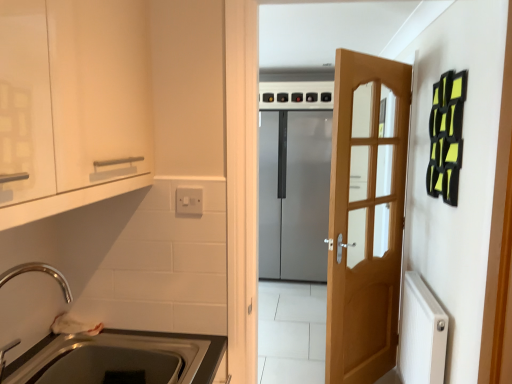
Question: Which direction should I rotate to face black plastic knob at upper center, placed as the first knob when sorted from left to right, — up or down?

Choices:
 (A) up
 (B) down

Answer: (A)

Question: Is white glossy cabinet at upper left positioned behind chrome metallic faucet at lower left?

Choices:
 (A) no
 (B) yes

Answer: (A)

Question: Considering the relative sizes of white glossy cabinet at upper left and chrome metallic faucet at lower left in the image provided, is white glossy cabinet at upper left bigger than chrome metallic faucet at lower left?

Choices:
 (A) no
 (B) yes

Answer: (B)

Question: Is white glossy cabinet at upper left positioned with its back to chrome metallic faucet at lower left?

Choices:
 (A) yes
 (B) no

Answer: (B)

Question: Does white glossy cabinet at upper left have a greater width compared to chrome metallic faucet at lower left?

Choices:
 (A) no
 (B) yes

Answer: (B)

Question: Is white glossy cabinet at upper left next to chrome metallic faucet at lower left?

Choices:
 (A) no
 (B) yes

Answer: (A)

Question: Considering the relative sizes of white glossy cabinet at upper left and chrome metallic faucet at lower left in the image provided, is white glossy cabinet at upper left taller than chrome metallic faucet at lower left?

Choices:
 (A) yes
 (B) no

Answer: (A)

Question: Considering the relative sizes of satin silver refrigerator at center and white plastic switch at upper center in the image provided, is satin silver refrigerator at center taller than white plastic switch at upper center?

Choices:
 (A) no
 (B) yes

Answer: (B)

Question: Can you confirm if satin silver refrigerator at center is positioned to the left of white plastic switch at upper center?

Choices:
 (A) yes
 (B) no

Answer: (B)

Question: From the image's perspective, is satin silver refrigerator at center under white plastic switch at upper center?

Choices:
 (A) no
 (B) yes

Answer: (A)

Question: From the image's perspective, would you say satin silver refrigerator at center is positioned over white plastic switch at upper center?

Choices:
 (A) no
 (B) yes

Answer: (B)

Question: Considering the relative sizes of satin silver refrigerator at center and white plastic switch at upper center in the image provided, is satin silver refrigerator at center wider than white plastic switch at upper center?

Choices:
 (A) yes
 (B) no

Answer: (A)

Question: Could you tell me if satin silver refrigerator at center is turned towards white plastic switch at upper center?

Choices:
 (A) no
 (B) yes

Answer: (B)

Question: From a real-world perspective, is white glossy cabinet at upper left located higher than metallic stainless steel sink at lower left?

Choices:
 (A) no
 (B) yes

Answer: (B)